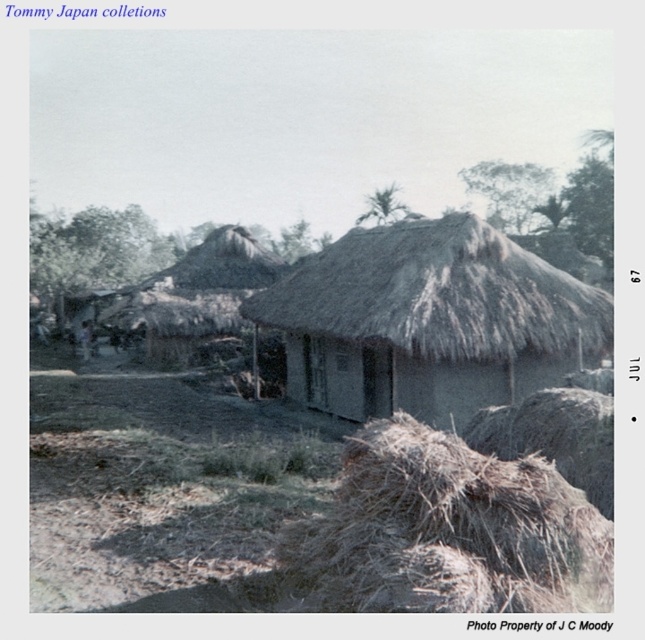
You are a traveler who needs to store your camping gear. You see the thatched straw hut at center and the brown straw at lower right. Which location has more space to accommodate your gear?

The thatched straw hut at center has a larger width than the brown straw at lower right, so it can accommodate more gear.